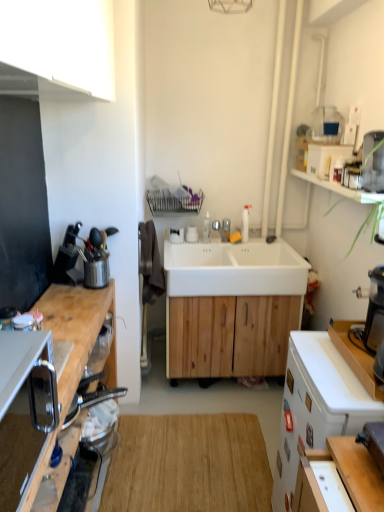
Find the location of a particular element. Image resolution: width=384 pixels, height=512 pixels. metallic silver utensil holder at left is located at coordinates (94, 259).

The image size is (384, 512). Identify the location of white wood cabinet at center. (231, 307).

What do you see at coordinates (231, 307) in the screenshot? I see `white wood cabinet at center` at bounding box center [231, 307].

This screenshot has width=384, height=512. In order to click on white matte cabinet at upper left, arranged as the 1th cabinetry when viewed from the top in this screenshot , I will do `click(57, 49)`.

The height and width of the screenshot is (512, 384). What are the coordinates of `metallic silver utensil holder at left` in the screenshot? It's located at (94, 259).

Are metallic silver utensil holder at left and white matte sink at center making contact?

No.

Is white matte sink at center completely or partially inside metallic silver utensil holder at left?

No, white matte sink at center is located outside of metallic silver utensil holder at left.

Where is `appliance in front of the white matte sink at center`? appliance in front of the white matte sink at center is located at coordinates (94, 259).

Is metallic silver utensil holder at left smaller than white matte sink at center?

Correct, metallic silver utensil holder at left occupies less space than white matte sink at center.

Based on the photo, is white matte counter top at right aimed at natural wood cutting board at center?

No, white matte counter top at right does not turn towards natural wood cutting board at center.

Between white matte counter top at right and natural wood cutting board at center, which one has smaller width?

white matte counter top at right.

Looking at this image, is white matte counter top at right surrounding natural wood cutting board at center?

Actually, natural wood cutting board at center is outside white matte counter top at right.

Is white glossy faucet at center positioned behind wooden cutting board at left, which appears as the 1th cabinetry when ordered from the bottom?

Yes, white glossy faucet at center is further from the camera.

Locate an element on the screen. The width and height of the screenshot is (384, 512). tap located above the wooden cutting board at left, which appears as the 1th cabinetry when ordered from the bottom (from the image's perspective) is located at coordinates (222, 229).

Is white glossy faucet at center far away from wooden cutting board at left, acting as the 2th cabinetry starting from the top?

Yes.

Is white glossy faucet at center located outside wooden cutting board at left, which appears as the 1th cabinetry when ordered from the bottom?

Yes.

Considering the relative sizes of wooden cutting board at left, which appears as the 1th cabinetry when ordered from the bottom, and white matte desk at right in the image provided, is wooden cutting board at left, which appears as the 1th cabinetry when ordered from the bottom, wider than white matte desk at right?

Incorrect, the width of wooden cutting board at left, which appears as the 1th cabinetry when ordered from the bottom, does not surpass that of white matte desk at right.

Measure the distance between wooden cutting board at left, which appears as the 1th cabinetry when ordered from the bottom, and white matte desk at right.

33.28 inches.

From the image's perspective, which cabinetry is the 1st one above the white matte desk at right? Please provide its 2D coordinates.

[(75, 328)]

Considering the relative sizes of white wood cabinet at center and white matte sink at center in the image provided, is white wood cabinet at center wider than white matte sink at center?

Yes.

Considering the sizes of white wood cabinet at center and white matte sink at center in the image, is white wood cabinet at center bigger or smaller than white matte sink at center?

Considering their sizes, white wood cabinet at center takes up more space than white matte sink at center.

Does white wood cabinet at center come behind white matte sink at center?

Yes, white wood cabinet at center is further from the viewer.

Consider the image. From the image's perspective, which one is positioned lower, white wood cabinet at center or white matte sink at center?

From the image's view, white wood cabinet at center is below.

Which object is wider, white glossy faucet at center or white matte cabinet at upper left, placed as the second cabinetry when sorted from bottom to top?

Wider between the two is white matte cabinet at upper left, placed as the second cabinetry when sorted from bottom to top.

In the image, is white glossy faucet at center positioned in front of or behind white matte cabinet at upper left, arranged as the 1th cabinetry when viewed from the top?

white glossy faucet at center is behind white matte cabinet at upper left, arranged as the 1th cabinetry when viewed from the top.

Considering the positions of points (217, 231) and (24, 1), is point (217, 231) farther from camera compared to point (24, 1)?

Yes, it is.

Considering the relative positions of white glossy faucet at center and white matte cabinet at upper left, arranged as the 1th cabinetry when viewed from the top, in the image provided, is white glossy faucet at center to the left or to the right of white matte cabinet at upper left, arranged as the 1th cabinetry when viewed from the top,?

Based on their positions, white glossy faucet at center is located to the right of white matte cabinet at upper left, arranged as the 1th cabinetry when viewed from the top.

From the image's perspective, which one is positioned higher, white matte desk at right or natural wood cutting board at center?

white matte desk at right is shown above in the image.

Is white matte desk at right positioned behind natural wood cutting board at center?

No, it is not.

Can we say white matte desk at right lies outside natural wood cutting board at center?

white matte desk at right is positioned outside natural wood cutting board at center.

From a real-world perspective, is white matte desk at right positioned above or below natural wood cutting board at center?

white matte desk at right is situated higher than natural wood cutting board at center in the real world.

Find the location of a particular element. This screenshot has height=512, width=384. sink below the metallic silver utensil holder at left (from a real-world perspective) is located at coordinates (234, 269).

The height and width of the screenshot is (512, 384). What are the coordinates of `counter top to the right of natural wood cutting board at center` in the screenshot? It's located at (355, 356).

Considering their positions, is white matte desk at right positioned closer to white glossy faucet at center than white matte counter top at right?

The object closer to white glossy faucet at center is white matte counter top at right.

Based on their spatial positions, is metallic silver utensil holder at left or white matte sink at center closer to satin silver phone at left?

The object closer to satin silver phone at left is metallic silver utensil holder at left.

Considering their positions, is white matte cabinet at upper left, placed as the second cabinetry when sorted from bottom to top, positioned closer to white glossy faucet at center than wooden cutting board at left, which appears as the 1th cabinetry when ordered from the bottom?

Among the two, wooden cutting board at left, which appears as the 1th cabinetry when ordered from the bottom, is located nearer to white glossy faucet at center.

Looking at this image, estimate the real-world distances between objects in this image. Which object is further from white wood cabinet at center, white glossy faucet at center or wooden cutting board at left, which appears as the 1th cabinetry when ordered from the bottom?

The object further to white wood cabinet at center is wooden cutting board at left, which appears as the 1th cabinetry when ordered from the bottom.

Which object lies nearer to the anchor point metallic silver utensil holder at left, white matte desk at right or white glossy faucet at center?

white glossy faucet at center.

Considering their positions, is white matte counter top at right positioned further to white matte desk at right than white glossy faucet at center?

white glossy faucet at center.

From the picture: Estimate the real-world distances between objects in this image. Which object is further from white matte sink at center, metallic silver utensil holder at left or white matte counter top at right?

white matte counter top at right.

Which object lies further to the anchor point white glossy faucet at center, wooden cutting board at left, acting as the 2th cabinetry starting from the top, or metallic silver utensil holder at left?

The object further to white glossy faucet at center is wooden cutting board at left, acting as the 2th cabinetry starting from the top.

Where is `counter top that lies between white matte cabinet at upper left, placed as the second cabinetry when sorted from bottom to top, and wooden cutting board at left, acting as the 2th cabinetry starting from the top, from top to bottom`? This screenshot has width=384, height=512. counter top that lies between white matte cabinet at upper left, placed as the second cabinetry when sorted from bottom to top, and wooden cutting board at left, acting as the 2th cabinetry starting from the top, from top to bottom is located at coordinates (355, 356).

You are a GUI agent. You are given a task and a screenshot of the screen. Output one action in this format:
    pyautogui.click(x=<x>, y=<y>)
    Task: Click on the desk between white matte counter top at right and natural wood cutting board at center in the front-back direction
    This screenshot has width=384, height=512.
    Given the screenshot: What is the action you would take?
    pyautogui.click(x=316, y=406)

At what (x,y) coordinates should I click in order to perform the action: click on hardwood between wooden cutting board at left, which appears as the 1th cabinetry when ordered from the bottom, and metallic silver utensil holder at left from front to back. Please return your answer as a coordinate pair (x, y). Looking at the image, I should click on (188, 464).

The image size is (384, 512). In order to click on appliance between wooden cutting board at left, which appears as the 1th cabinetry when ordered from the bottom, and white matte desk at right in this screenshot , I will do `click(94, 259)`.